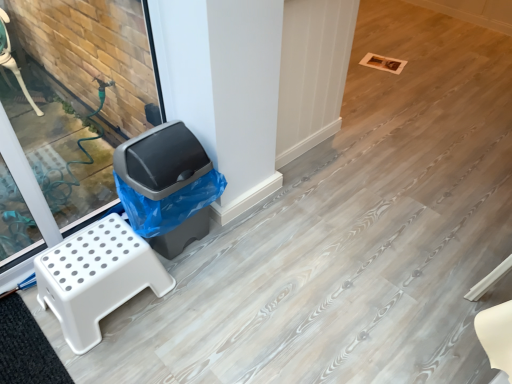
What do you see at coordinates (161, 161) in the screenshot? The width and height of the screenshot is (512, 384). I see `gray plastic trash can at left` at bounding box center [161, 161].

You are a GUI agent. You are given a task and a screenshot of the screen. Output one action in this format:
    pyautogui.click(x=<x>, y=<y>)
    Task: Click on the gray plastic trash can at left
    
    Given the screenshot: What is the action you would take?
    pyautogui.click(x=161, y=161)

Find the location of a particular element. The image size is (512, 384). white plastic step stool at left is located at coordinates (96, 277).

From the image's perspective, who appears lower, gray plastic trash can at left or black rubber mat at lower left?

black rubber mat at lower left appears lower in the image.

Is gray plastic trash can at left situated inside black rubber mat at lower left or outside?

gray plastic trash can at left exists outside the volume of black rubber mat at lower left.

Considering their positions, is gray plastic trash can at left located in front of or behind black rubber mat at lower left?

Visually, gray plastic trash can at left is located behind black rubber mat at lower left.

From a real-world perspective, is white plastic step stool at left on gray plastic trash can at left?

Actually, white plastic step stool at left is physically below gray plastic trash can at left in the real world.

From the image's perspective, who appears lower, white plastic step stool at left or gray plastic trash can at left?

From the image's view, white plastic step stool at left is below.

Does white plastic step stool at left lie in front of gray plastic trash can at left?

Yes, white plastic step stool at left is closer to the viewer.

Is white plastic step stool at left positioned beyond the bounds of gray plastic trash can at left?

white plastic step stool at left is positioned outside gray plastic trash can at left.

Can you confirm if black rubber mat at lower left is taller than white plastic step stool at left?

In fact, black rubber mat at lower left may be shorter than white plastic step stool at left.

Measure the distance from black rubber mat at lower left to white plastic step stool at left.

They are 25.91 centimeters apart.

Which is in front, black rubber mat at lower left or white plastic step stool at left?

black rubber mat at lower left is in front.

Considering the sizes of gray plastic trash can at left and white plastic step stool at left in the image, is gray plastic trash can at left taller or shorter than white plastic step stool at left?

In the image, gray plastic trash can at left appears to be taller than white plastic step stool at left.

You are a GUI agent. You are given a task and a screenshot of the screen. Output one action in this format:
    pyautogui.click(x=<x>, y=<y>)
    Task: Click on the furniture in front of the gray plastic trash can at left
    The image size is (512, 384).
    Given the screenshot: What is the action you would take?
    pyautogui.click(x=96, y=277)

From the image's perspective, which is above, gray plastic trash can at left or white plastic step stool at left?

gray plastic trash can at left is shown above in the image.

Which object is positioned more to the left, gray plastic trash can at left or white plastic step stool at left?

white plastic step stool at left.

From a real-world perspective, does white plastic step stool at left stand above black rubber mat at lower left?

Yes, from a real-world perspective, white plastic step stool at left is above black rubber mat at lower left.

Is black rubber mat at lower left inside white plastic step stool at left?

No, white plastic step stool at left does not contain black rubber mat at lower left.

Does point (76, 308) come behind point (11, 333)?

No, (76, 308) is closer to viewer.

Is the surface of white plastic step stool at left in direct contact with black rubber mat at lower left?

They are not placed beside each other.

Does black rubber mat at lower left have a lesser width compared to gray plastic trash can at left?

Yes.

From a real-world perspective, does black rubber mat at lower left stand above gray plastic trash can at left?

No, from a real-world perspective, black rubber mat at lower left is not over gray plastic trash can at left

Between black rubber mat at lower left and gray plastic trash can at left, which one has less height?

With less height is black rubber mat at lower left.

Which is in front, black rubber mat at lower left or gray plastic trash can at left?

black rubber mat at lower left is in front.

You are a GUI agent. You are given a task and a screenshot of the screen. Output one action in this format:
    pyautogui.click(x=<x>, y=<y>)
    Task: Click on the mat below the gray plastic trash can at left (from the image's perspective)
    This screenshot has width=512, height=384.
    Given the screenshot: What is the action you would take?
    pyautogui.click(x=26, y=347)

In the image, there is a white plastic step stool at left. Find the location of `waste container above it (from the image's perspective)`. waste container above it (from the image's perspective) is located at coordinates (161, 161).

When comparing their distances from white plastic step stool at left, does gray plastic trash can at left or black rubber mat at lower left seem further?

The object further to white plastic step stool at left is gray plastic trash can at left.

Considering their positions, is gray plastic trash can at left positioned closer to black rubber mat at lower left than white plastic step stool at left?

white plastic step stool at left.

Looking at the image, which one is located further to gray plastic trash can at left, black rubber mat at lower left or white plastic step stool at left?

Among the two, black rubber mat at lower left is located further to gray plastic trash can at left.

Estimate the real-world distances between objects in this image. Which object is further from gray plastic trash can at left, white plastic step stool at left or black rubber mat at lower left?

black rubber mat at lower left lies further to gray plastic trash can at left than the other object.

Considering their positions, is black rubber mat at lower left positioned closer to white plastic step stool at left than gray plastic trash can at left?

black rubber mat at lower left is positioned closer to the anchor white plastic step stool at left.

Estimate the real-world distances between objects in this image. Which object is further from black rubber mat at lower left, white plastic step stool at left or gray plastic trash can at left?

Based on the image, gray plastic trash can at left appears to be further to black rubber mat at lower left.

Identify the location of furniture between gray plastic trash can at left and black rubber mat at lower left vertically. Image resolution: width=512 pixels, height=384 pixels. (96, 277).